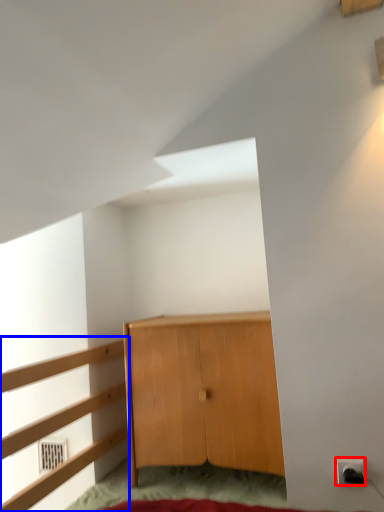
Question: Among these objects, which one is farthest to the camera, electric outlet (highlighted by a red box) or dresser (highlighted by a blue box)?

Choices:
 (A) electric outlet
 (B) dresser

Answer: (A)